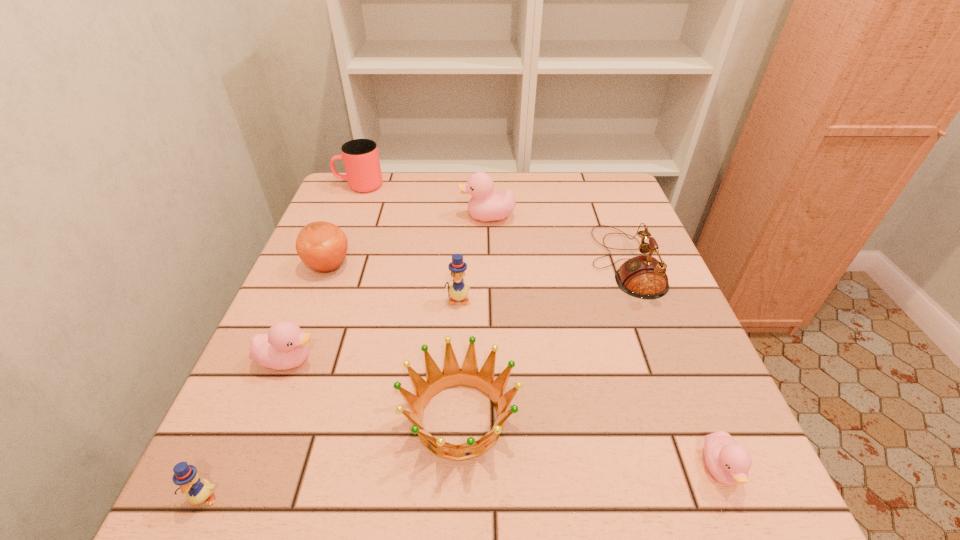
The image size is (960, 540). What are the coordinates of `the biggest pink duckling` in the screenshot? It's located at (484, 206).

This screenshot has width=960, height=540. In order to click on the farthest pink duckling in this screenshot , I will do `click(484, 206)`.

Identify the location of cup. Image resolution: width=960 pixels, height=540 pixels. (361, 160).

Locate an element on the screen. The width and height of the screenshot is (960, 540). pink cup is located at coordinates (361, 160).

Identify the location of the right yellow duckling. (458, 290).

Find the location of `the fourth nearest duckling`. the fourth nearest duckling is located at coordinates (458, 290).

What are the coordinates of `orange` in the screenshot? It's located at (322, 246).

Find the location of a particular element. Image resolution: width=960 pixels, height=540 pixels. telephone is located at coordinates (644, 277).

Identify the location of the leftmost pink duckling. (285, 346).

I want to click on the second farthest pink duckling, so click(x=285, y=346).